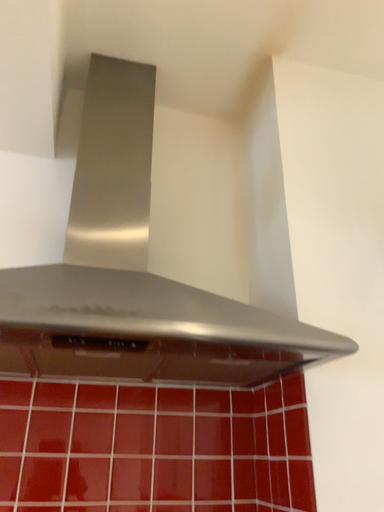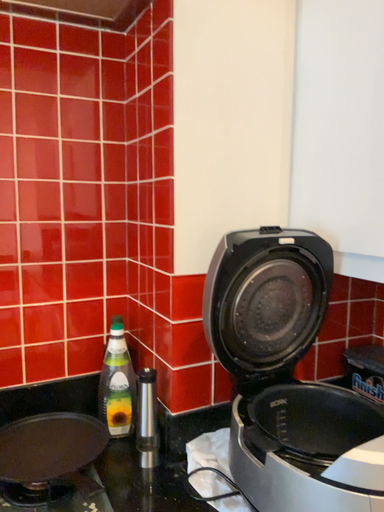
Question: How did the camera likely rotate when shooting the video?

Choices:
 (A) rotated left
 (B) rotated right

Answer: (B)